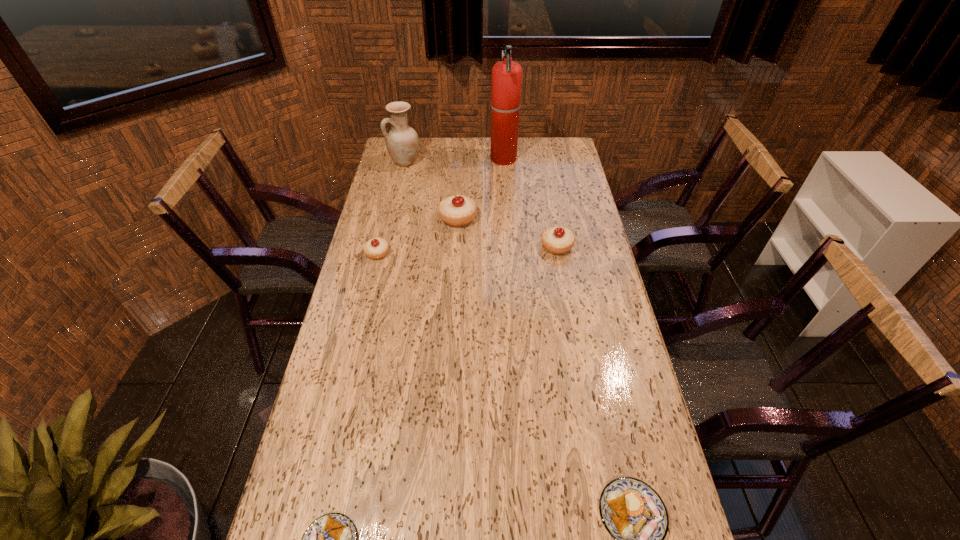
The width and height of the screenshot is (960, 540). Identify the location of pastry at the left edge. point(376,248).

Where is `object that is at the right edge`? Image resolution: width=960 pixels, height=540 pixels. object that is at the right edge is located at coordinates (557, 240).

Where is `object that is positioned at the far left corner`? object that is positioned at the far left corner is located at coordinates (402, 142).

The height and width of the screenshot is (540, 960). I want to click on vacant space at the far edge of the desktop, so click(x=451, y=158).

You are a GUI agent. You are given a task and a screenshot of the screen. Output one action in this format:
    pyautogui.click(x=<x>, y=<y>)
    Task: Click on the free space at the left edge of the desktop
    This screenshot has height=540, width=960.
    Given the screenshot: What is the action you would take?
    pyautogui.click(x=392, y=197)

In the image, there is a desktop. Where is `vacant space at the right edge`? Image resolution: width=960 pixels, height=540 pixels. vacant space at the right edge is located at coordinates (593, 233).

The height and width of the screenshot is (540, 960). In order to click on blank region between the leftmost beige pastry and the fourth shortest object in this screenshot , I will do `click(468, 249)`.

Image resolution: width=960 pixels, height=540 pixels. Find the location of `object that can be found as the second closest to the tallest object`. object that can be found as the second closest to the tallest object is located at coordinates (402, 142).

Locate an element on the screen. This screenshot has width=960, height=540. object that stands as the fifth closest to the third tallest pastry is located at coordinates (331, 539).

Identify the location of the second closest pastry to the fourth tallest pastry. (557, 240).